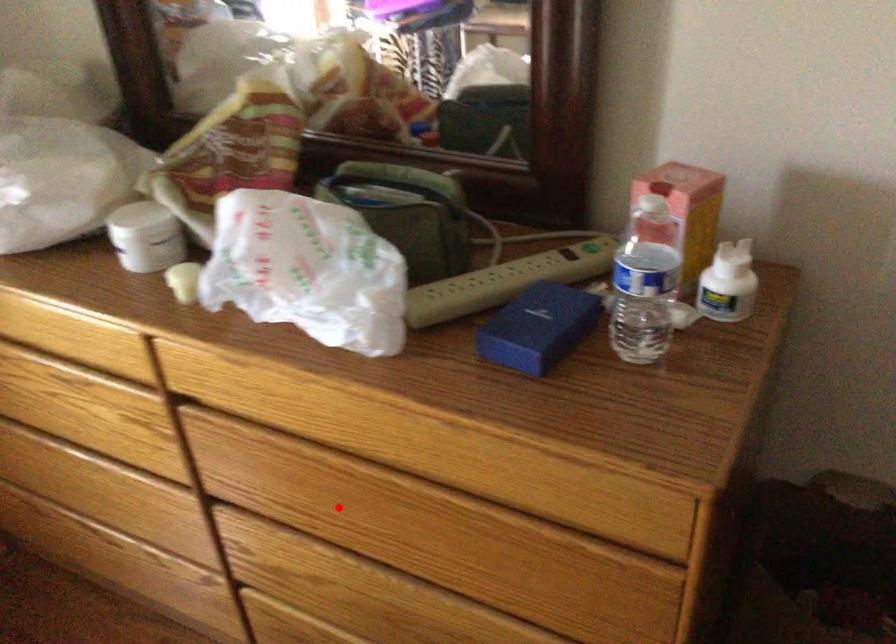
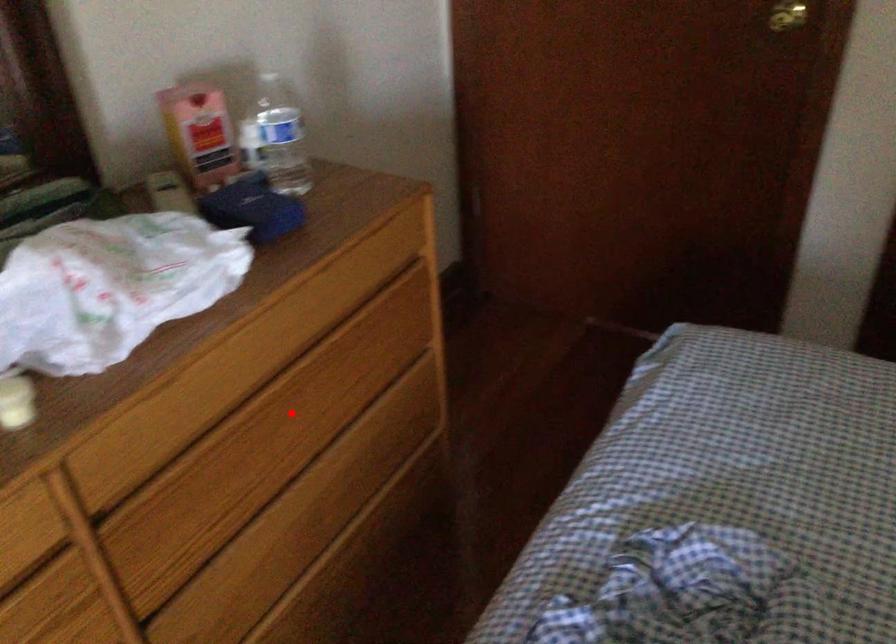
I am providing you with two images of the same scene from different viewpoints. A red point is marked on the first image and another point is marked on the second image. Does the point marked in image1 correspond to the same location as the one in image2?

No